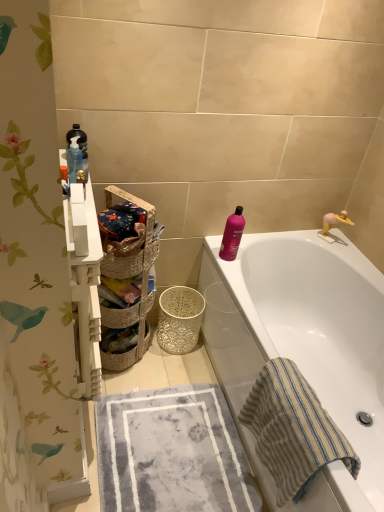
Question: Considering their positions, is woven beige basket at left located in front of or behind gray textured towel at lower center, which is the 1th beach towel in left-to-right order?

Choices:
 (A) behind
 (B) front

Answer: (A)

Question: From the image's perspective, is woven beige basket at left located above or below gray textured towel at lower center, positioned as the 2th beach towel in right-to-left order?

Choices:
 (A) above
 (B) below

Answer: (A)

Question: Which of these objects is positioned closest to the woven natural basket at center, arranged as the second basket when viewed from the back?

Choices:
 (A) gray textured towel at lower center, which is the 1th beach towel in left-to-right order
 (B) translucent plastic bottles at upper left, which is counted as the first cleaning product, starting from the left
 (C) beige striped towel at lower right, the second beach towel viewed from the left
 (D) white glossy bathtub at upper right
 (E) woven beige basket at left

Answer: (E)

Question: Which object is positioned closest to the beige striped towel at lower right, which ranks as the first beach towel in right-to-left order?

Choices:
 (A) gray textured towel at lower center, positioned as the 2th beach towel in right-to-left order
 (B) woven brown basket at center, arranged as the 2th basket when viewed from the front
 (C) pink glossy bottle at upper right, the 1th cleaning product positioned from the back
 (D) woven natural basket at center, positioned as the 1th basket in front-to-back order
 (E) woven beige basket at left

Answer: (A)